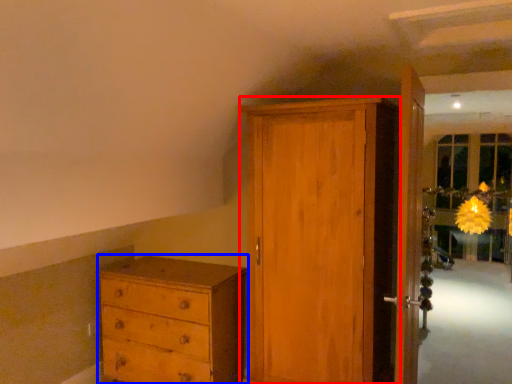
Question: Which point is closer to the camera, door (highlighted by a red box) or chest of drawers (highlighted by a blue box)?

Choices:
 (A) door
 (B) chest of drawers

Answer: (A)